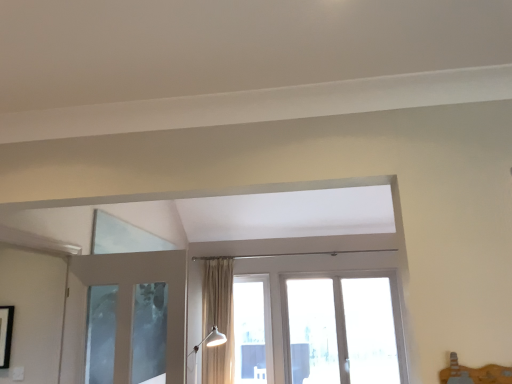
Question: Does point (219, 339) appear closer or farther from the camera than point (228, 306)?

Choices:
 (A) closer
 (B) farther

Answer: (A)

Question: From the image's perspective, is white glossy floor lamp at lower center above or below beige fabric curtain at center?

Choices:
 (A) below
 (B) above

Answer: (A)

Question: Which of these objects is positioned closest to the white glossy floor lamp at lower center?

Choices:
 (A) beige fabric curtain at center
 (B) clear glass window at center

Answer: (A)

Question: Which of these objects is positioned farthest from the white glossy floor lamp at lower center?

Choices:
 (A) beige fabric curtain at center
 (B) clear glass window at center

Answer: (B)